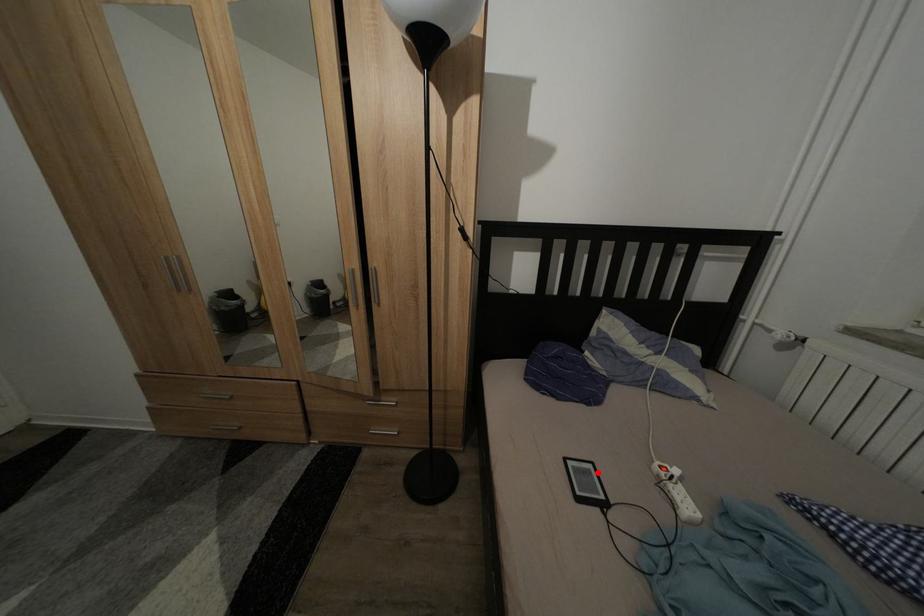
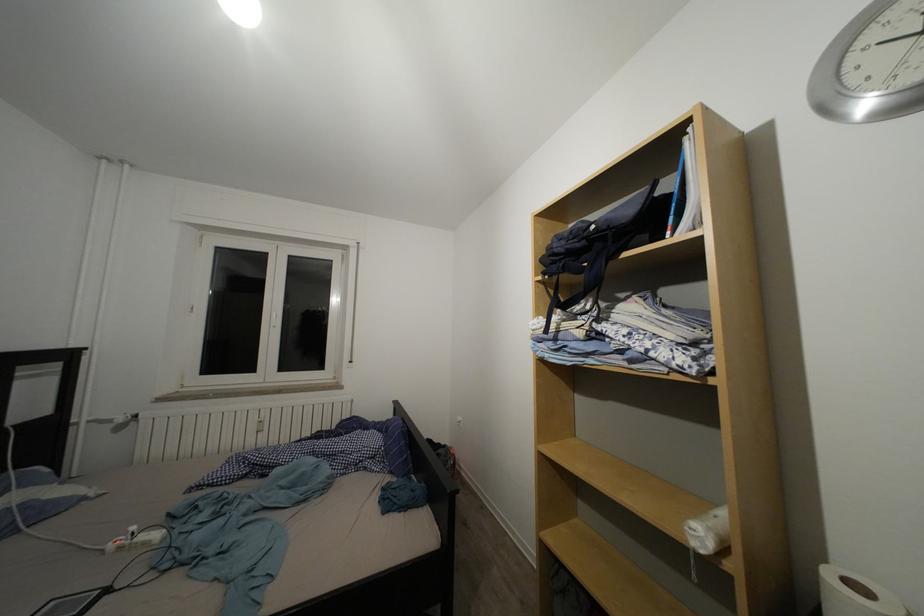
Question: I am providing you with two images of the same scene from different viewpoints. A red point is marked on the first image. Can you still see the location of the red point in image 2?

Choices:
 (A) Yes
 (B) No

Answer: (A)